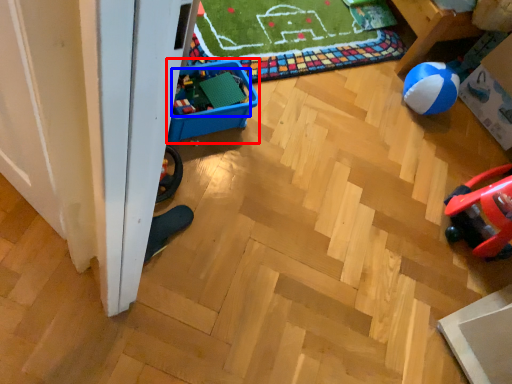
Question: Which of the following is the farthest to the observer, storage box (highlighted by a red box) or toy (highlighted by a blue box)?

Choices:
 (A) storage box
 (B) toy

Answer: (B)